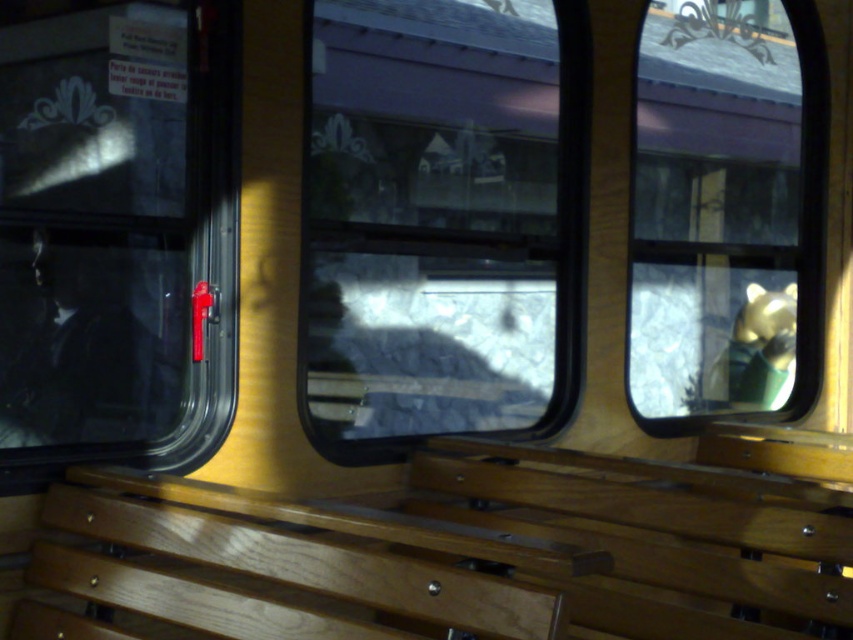
Is wooden bench at center smaller than gold metallic bear at upper right?

Incorrect, wooden bench at center is not smaller in size than gold metallic bear at upper right.

Measure the distance from wooden bench at center to gold metallic bear at upper right.

wooden bench at center is 4.44 feet from gold metallic bear at upper right.

Which is behind, point (543, 524) or point (660, 17)?

Positioned behind is point (660, 17).

In order to click on wooden bench at center in this screenshot , I will do `click(447, 556)`.

Does point (831, 556) come closer to viewer compared to point (492, 96)?

Yes, point (831, 556) is in front of point (492, 96).

Can you confirm if wooden bench at center is wider than transparent glass window at center?

Indeed, wooden bench at center has a greater width compared to transparent glass window at center.

Is point (764, 570) behind point (381, 285)?

No, it is in front of (381, 285).

Find the location of a particular element. The height and width of the screenshot is (640, 853). wooden bench at center is located at coordinates (447, 556).

Does transparent glass window at center have a lesser width compared to transparent glass window at left?

Incorrect, transparent glass window at center's width is not less than transparent glass window at left's.

Who is lower down, transparent glass window at center or transparent glass window at left?

transparent glass window at left

Find the location of `transparent glass window at center`. transparent glass window at center is located at coordinates point(440,220).

At what (x,y) coordinates should I click in order to perform the action: click on transparent glass window at center. Please return your answer as a coordinate pair (x, y). Looking at the image, I should click on (440, 220).